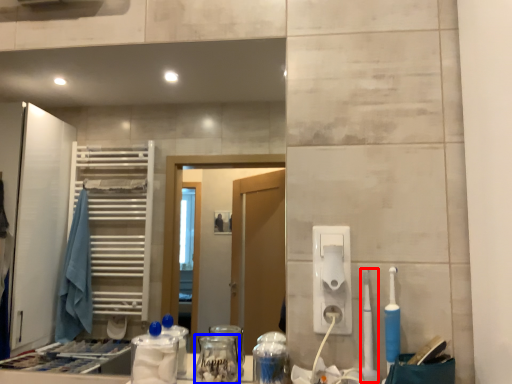
Question: Which point is further to the camera, toothbrush (highlighted by a red box) or glass jar (highlighted by a blue box)?

Choices:
 (A) toothbrush
 (B) glass jar

Answer: (A)